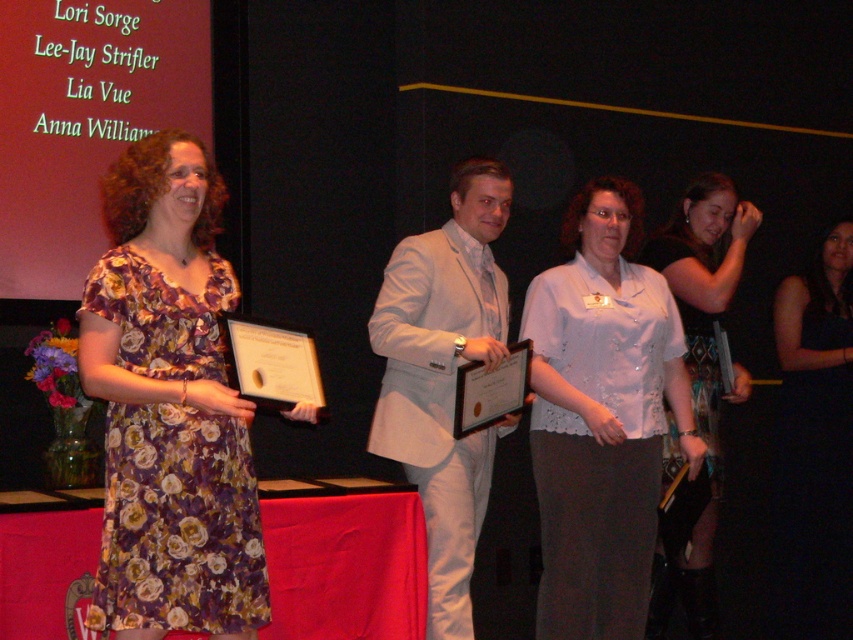
Is light gray suit at center above black satin dress at center?

Indeed, light gray suit at center is positioned over black satin dress at center.

The image size is (853, 640). In order to click on light gray suit at center in this screenshot , I will do `click(444, 376)`.

Does floral dress at left appear on the right side of black satin dress at center?

In fact, floral dress at left is to the left of black satin dress at center.

Identify the location of floral dress at left. pyautogui.click(x=169, y=406).

Image resolution: width=853 pixels, height=640 pixels. Describe the element at coordinates (169, 406) in the screenshot. I see `floral dress at left` at that location.

I want to click on floral dress at left, so click(x=169, y=406).

Is point (222, 605) less distant than point (602, 428)?

That is True.

From the picture: Is floral dress at left positioned before white lace blouse at center?

Yes, floral dress at left is closer to the viewer.

The image size is (853, 640). What do you see at coordinates (169, 406) in the screenshot? I see `floral dress at left` at bounding box center [169, 406].

Identify the location of floral dress at left. The width and height of the screenshot is (853, 640). (169, 406).